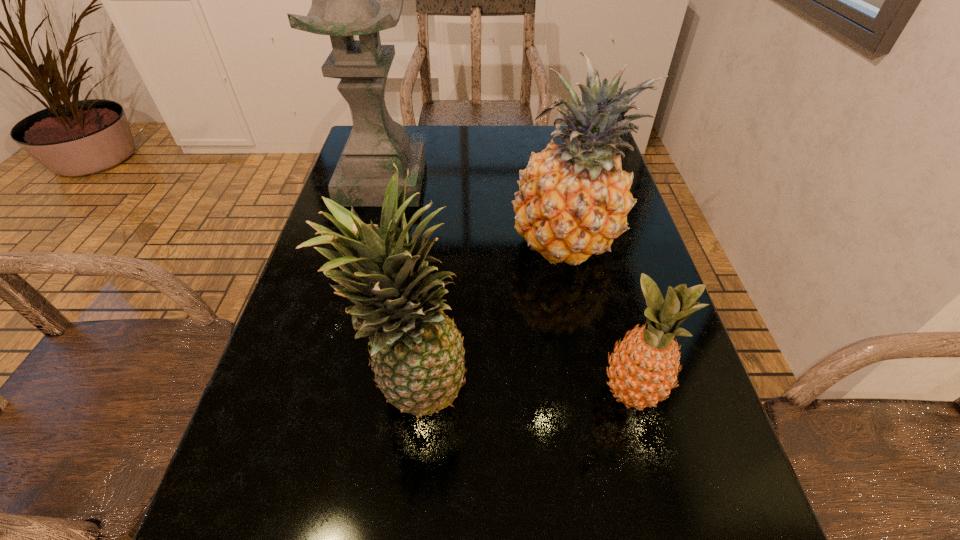
Where is `vacant area that lies between the second farthest object and the leftmost pineapple`? The width and height of the screenshot is (960, 540). vacant area that lies between the second farthest object and the leftmost pineapple is located at coordinates (491, 317).

In order to click on empty location between the third nearest object and the leftmost pineapple in this screenshot , I will do pyautogui.click(x=491, y=317).

Find the location of `vacant region between the farthest pineapple and the leftmost pineapple`. vacant region between the farthest pineapple and the leftmost pineapple is located at coordinates pyautogui.click(x=491, y=317).

The image size is (960, 540). I want to click on object that stands as the closest to the shortest pineapple, so click(x=573, y=200).

This screenshot has width=960, height=540. Find the location of `the third closest object to the farthest pineapple`. the third closest object to the farthest pineapple is located at coordinates (344, 4).

Locate which pineapple is the closest to the leftmost pineapple. Please provide its 2D coordinates. Your answer should be formatted as a tuple, i.e. [(x, y)], where the tuple contains the x and y coordinates of a point satisfying the conditions above.

[(573, 200)]

Select which pineapple is the second closest to the farthest pineapple. Please provide its 2D coordinates. Your answer should be formatted as a tuple, i.e. [(x, y)], where the tuple contains the x and y coordinates of a point satisfying the conditions above.

[(643, 369)]

Locate an element on the screen. This screenshot has height=540, width=960. free space that satisfies the following two spatial constraints: 1. at the front opening of the shortest pineapple; 2. on the right side of the farthest object is located at coordinates (325, 393).

Locate an element on the screen. The height and width of the screenshot is (540, 960). free space that satisfies the following two spatial constraints: 1. at the front opening of the shortest object; 2. on the left side of the farthest object is located at coordinates (325, 393).